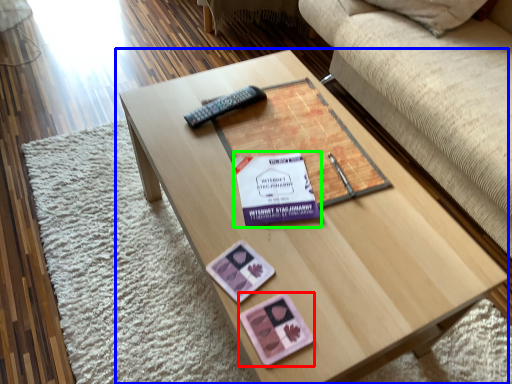
Question: Based on their relative distances, which object is farther from currency (highlighted by a red box)? Choose from coffee table (highlighted by a blue box) and paperback book (highlighted by a green box).

Choices:
 (A) coffee table
 (B) paperback book

Answer: (A)